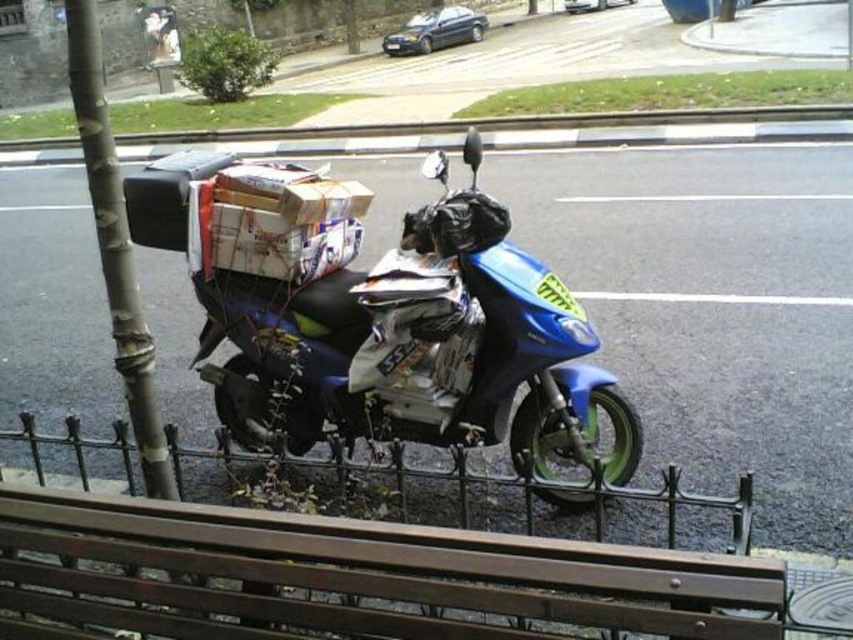
Question: Does brown wooden bench at lower center appear under blue glossy motorcycle at center?

Choices:
 (A) no
 (B) yes

Answer: (B)

Question: Is brown wooden bench at lower center further to camera compared to smooth gray pole at left?

Choices:
 (A) yes
 (B) no

Answer: (B)

Question: Which point is closer to the camera?

Choices:
 (A) smooth gray pole at left
 (B) blue glossy motorcycle at center

Answer: (A)

Question: Among these objects, which one is farthest from the camera?

Choices:
 (A) smooth gray pole at left
 (B) brown wooden bench at lower center

Answer: (A)

Question: Does brown wooden bench at lower center appear on the right side of blue glossy motorcycle at center?

Choices:
 (A) yes
 (B) no

Answer: (B)

Question: Estimate the real-world distances between objects in this image. Which object is closer to the smooth gray pole at left?

Choices:
 (A) brown wooden bench at lower center
 (B) blue glossy motorcycle at center

Answer: (A)